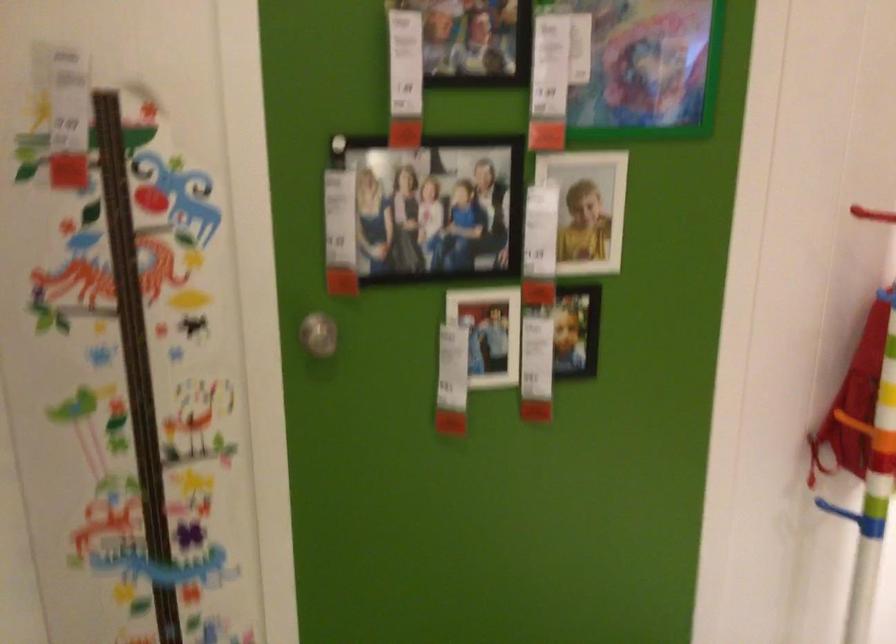
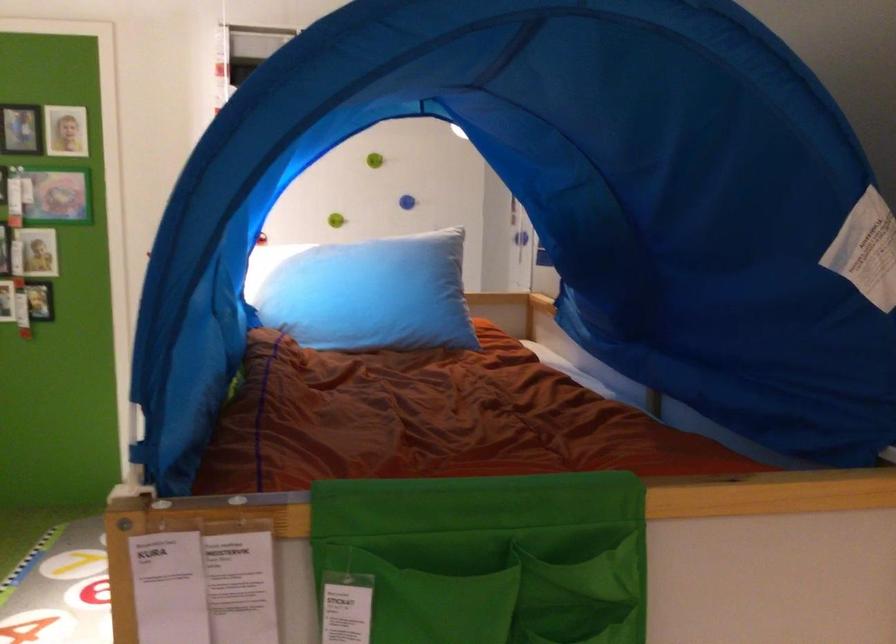
The images are taken continuously from a first-person perspective. In which direction are you moving?

The cameraman walked toward right, backward.